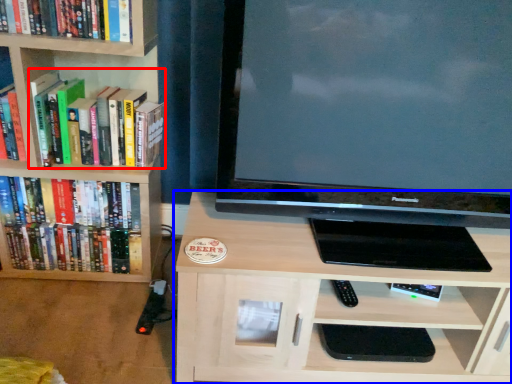
Question: Which of the following is the closest to the observer, book (highlighted by a red box) or shelf (highlighted by a blue box)?

Choices:
 (A) book
 (B) shelf

Answer: (B)